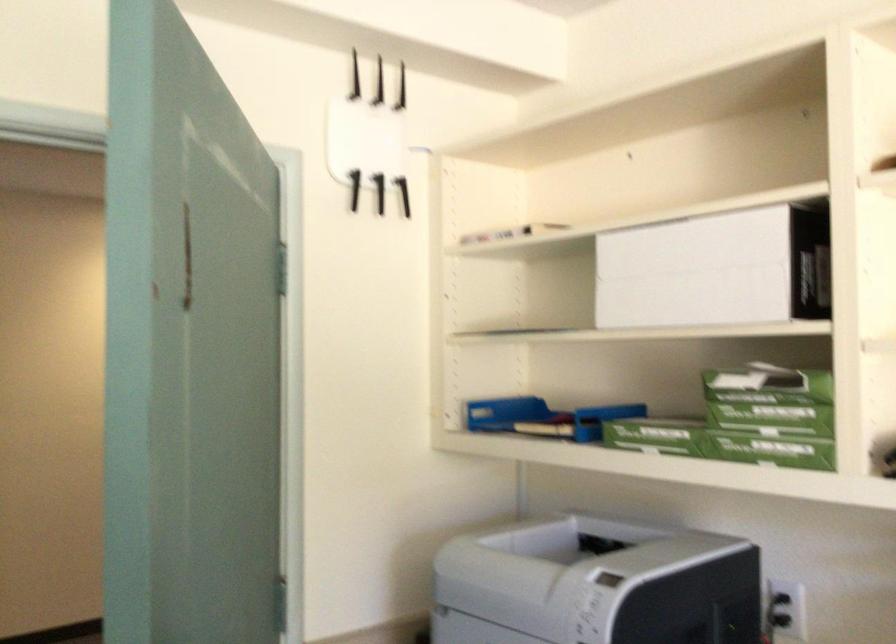
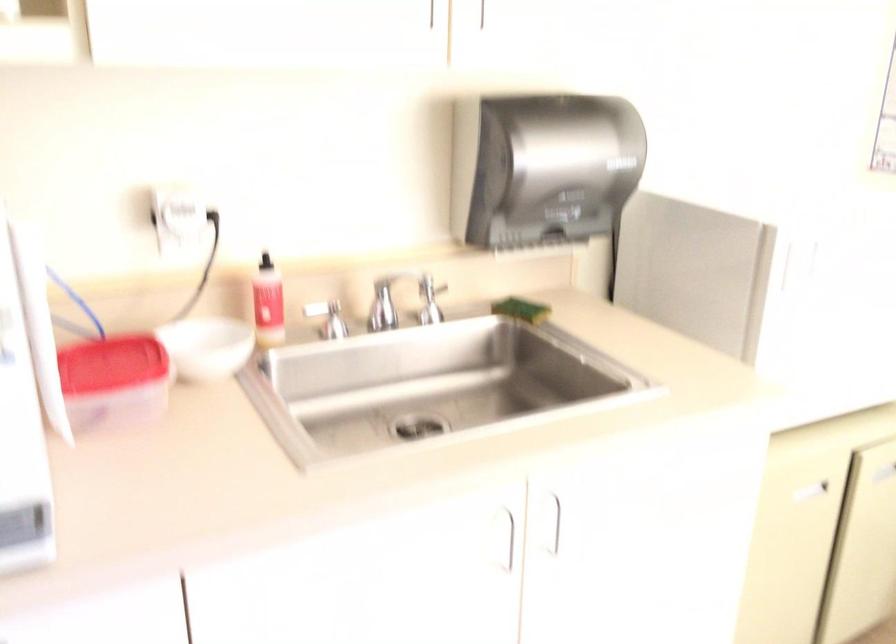
The images are taken continuously from a first-person perspective. In which direction is your viewpoint rotating?

The rotation direction of the camera is right-down.